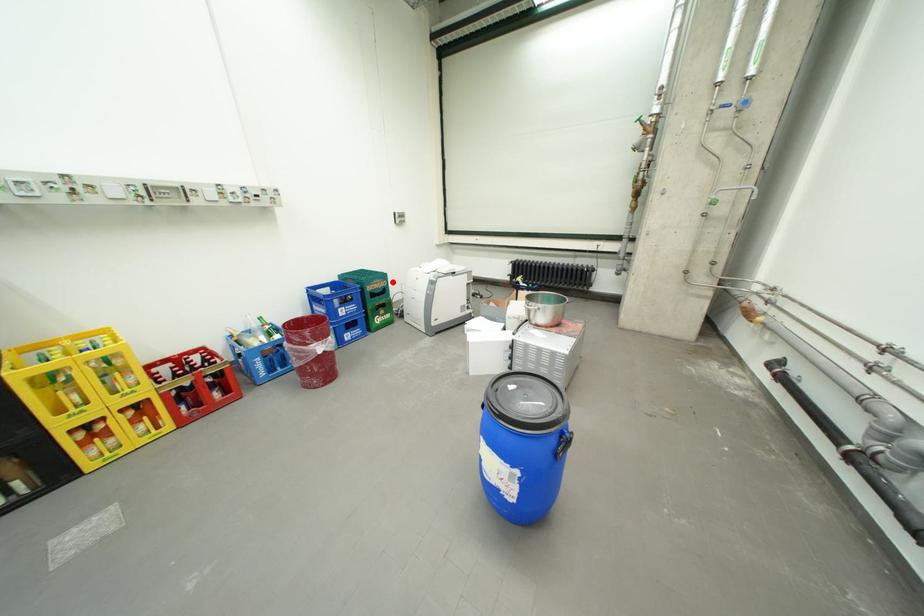
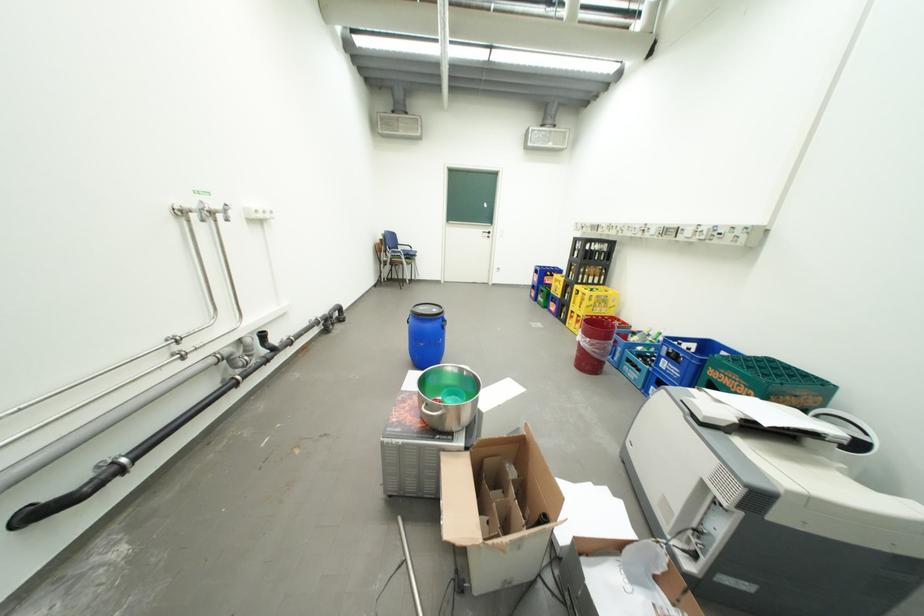
Question: I am providing you with two images of the same scene from different viewpoints. In image1, a red point is highlighted. Considering the same 3D point in image2, which of the following is correct?

Choices:
 (A) It is closer
 (B) It is farther

Answer: (B)